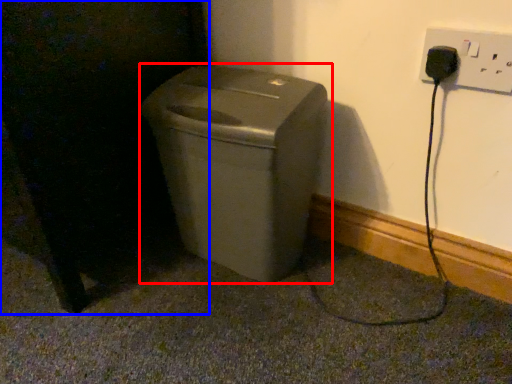
Question: Which object appears closest to the camera in this image, waste container (highlighted by a red box) or dark (highlighted by a blue box)?

Choices:
 (A) waste container
 (B) dark

Answer: (B)